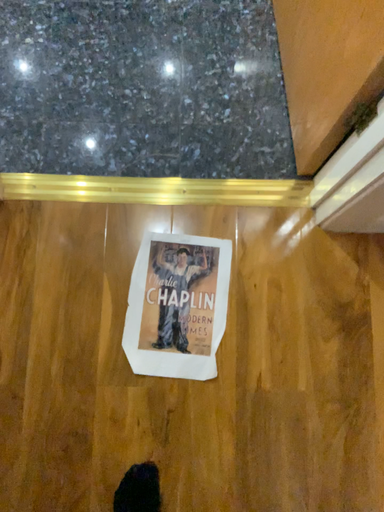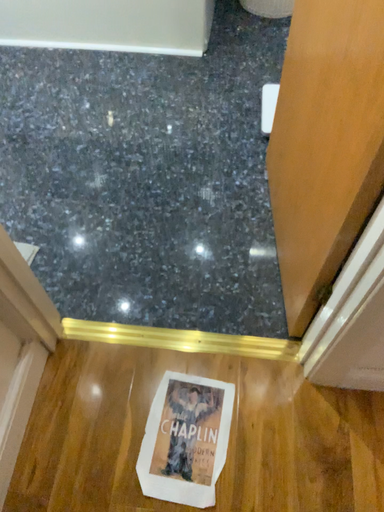
Question: Which way did the camera rotate in the video?

Choices:
 (A) rotated upward
 (B) rotated downward

Answer: (A)